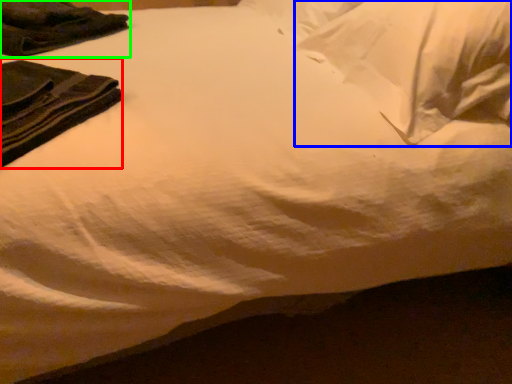
Question: Which object is positioned farthest from clothing (highlighted by a red box)? Select from pillow (highlighted by a blue box) and clothing (highlighted by a green box).

Choices:
 (A) pillow
 (B) clothing

Answer: (A)